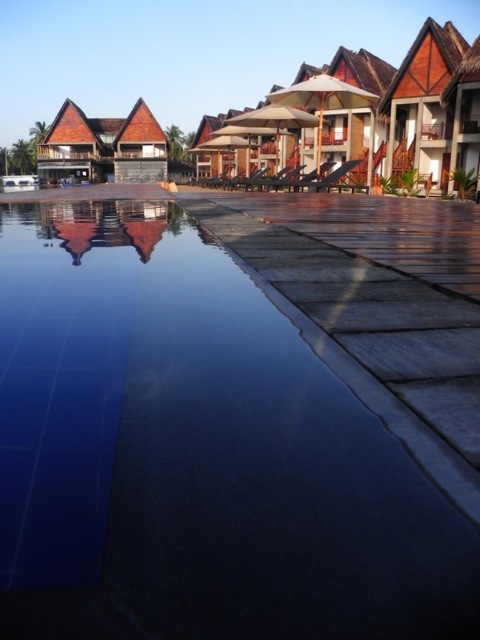
Question: Considering the relative positions of transparent glass water at center and wooden thatched hut at upper right in the image provided, where is transparent glass water at center located with respect to wooden thatched hut at upper right?

Choices:
 (A) below
 (B) above

Answer: (A)

Question: Which object is farther from the camera taking this photo?

Choices:
 (A) wooden thatched hut at upper right
 (B) transparent glass water at center
 (C) wooden thatched hut at left
 (D) wooden hut at upper right

Answer: (C)

Question: Which object is closer to the camera taking this photo?

Choices:
 (A) wooden thatched hut at upper right
 (B) transparent glass water at center
 (C) wooden hut at upper right

Answer: (B)

Question: Which object is the closest to the wooden hut at upper right?

Choices:
 (A) wooden thatched hut at upper right
 (B) wooden lounge chairs at upper center
 (C) wooden thatched hut at left

Answer: (A)

Question: Is wooden thatched hut at left thinner than wooden thatched hut at upper right?

Choices:
 (A) yes
 (B) no

Answer: (B)

Question: Can you confirm if transparent glass water at center is wider than wooden thatched hut at upper right?

Choices:
 (A) yes
 (B) no

Answer: (B)